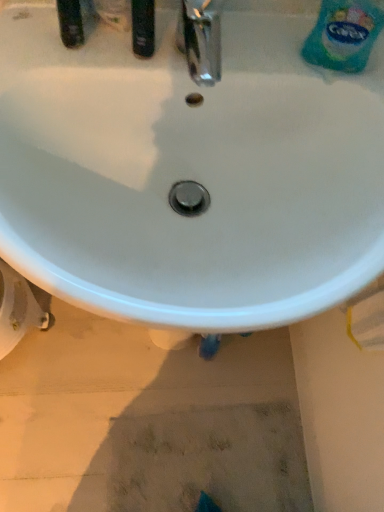
Question: Relative to blue plastic bottle at upper right, is white plastic bidet at lower left in front or behind?

Choices:
 (A) behind
 (B) front

Answer: (A)

Question: Considering the positions of white plastic bidet at lower left and blue plastic bottle at upper right in the image, is white plastic bidet at lower left wider or thinner than blue plastic bottle at upper right?

Choices:
 (A) thin
 (B) wide

Answer: (B)

Question: Which object is the farthest from the white plastic bidet at lower left?

Choices:
 (A) white glossy sink at center
 (B) blue plastic bottle at upper right

Answer: (B)

Question: Which object is the farthest from the white glossy sink at center?

Choices:
 (A) white plastic bidet at lower left
 (B) blue plastic bottle at upper right

Answer: (A)